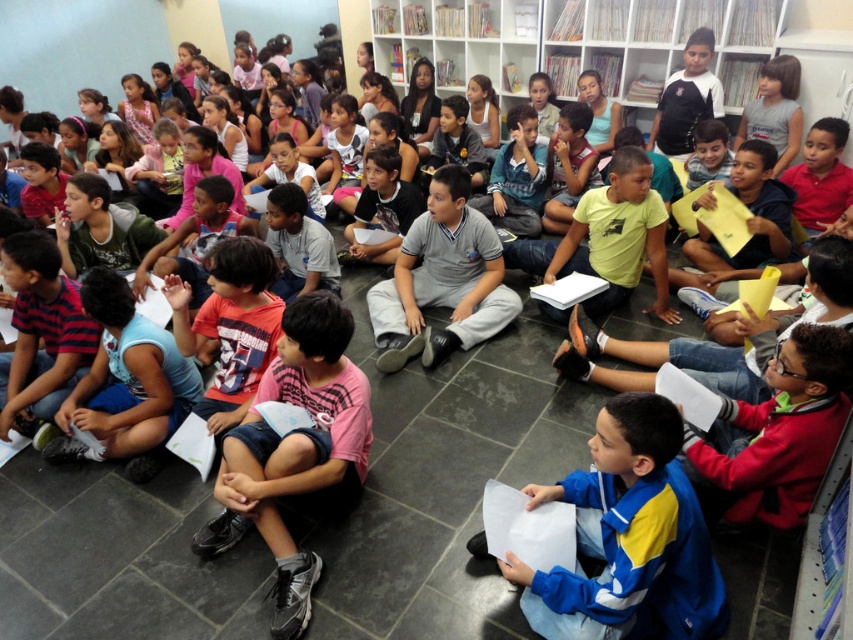
Consider the image. Which is more to the left, white glossy bookshelf at upper center or gray cotton shirt at center?

Positioned to the left is gray cotton shirt at center.

Who is more distant from viewer, (582, 13) or (456, 189)?

The point (582, 13) is behind.

At what (x,y) coordinates should I click in order to perform the action: click on white glossy bookshelf at upper center. Please return your answer as a coordinate pair (x, y). The image size is (853, 640). Looking at the image, I should click on (577, 44).